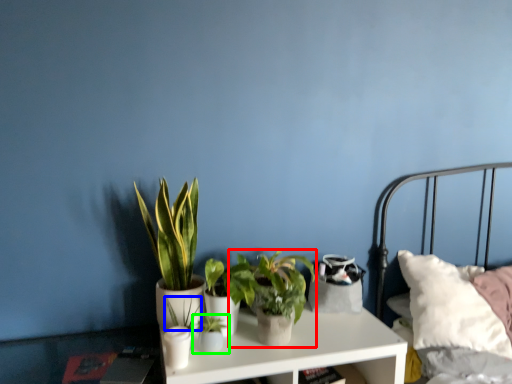
Question: Considering the real-world distances, which object is farthest from houseplant (highlighted by a red box)? plant (highlighted by a blue box) or houseplant (highlighted by a green box)?

Choices:
 (A) plant
 (B) houseplant

Answer: (A)